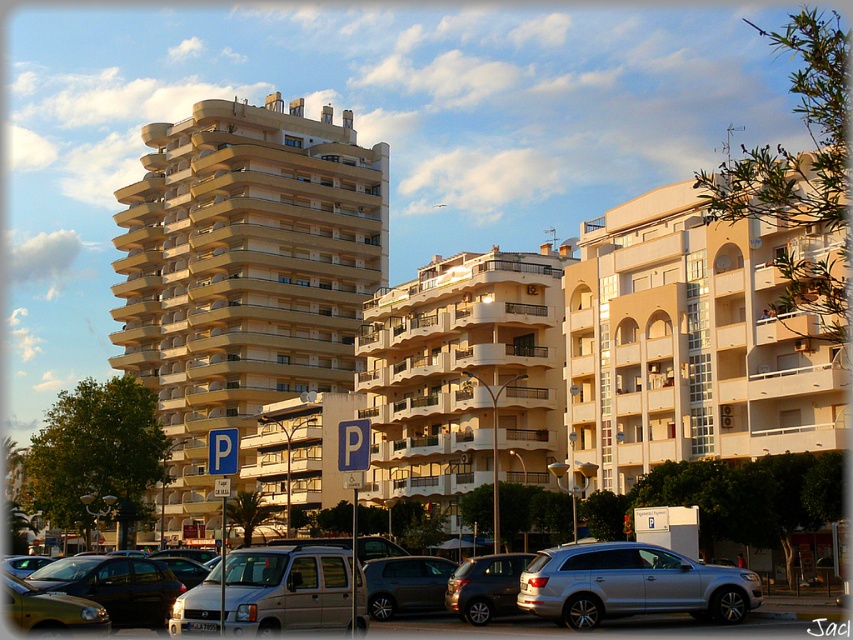
Who is more distant from viewer, (346, 192) or (392, 596)?

Point (346, 192)

Where is `beige concrete building at center`? The height and width of the screenshot is (640, 853). beige concrete building at center is located at coordinates (244, 272).

The height and width of the screenshot is (640, 853). What are the coordinates of `beige concrete building at center` in the screenshot? It's located at (244, 272).

Is point (395, 570) behind point (469, 580)?

Yes, point (395, 570) is behind point (469, 580).

Is dark gray metallic suv at center taller than matte silver suv at center?

No, dark gray metallic suv at center is not taller than matte silver suv at center.

The image size is (853, 640). Find the location of `dark gray metallic suv at center`. dark gray metallic suv at center is located at coordinates (405, 584).

Can you confirm if beige concrete building at center is bigger than matte silver suv at center?

Indeed, beige concrete building at center has a larger size compared to matte silver suv at center.

Between beige concrete building at center and matte silver suv at center, which one is positioned higher?

Positioned higher is beige concrete building at center.

At what (x,y) coordinates should I click in order to perform the action: click on beige concrete building at center. Please return your answer as a coordinate pair (x, y). Looking at the image, I should click on (244, 272).

Where is `beige concrete building at center`? This screenshot has width=853, height=640. beige concrete building at center is located at coordinates (244, 272).